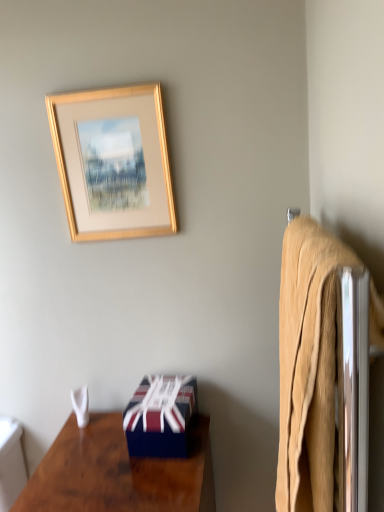
The image size is (384, 512). In order to click on blue glossy box at lower center in this screenshot , I will do `click(160, 416)`.

Is gold wooden picture frame at upper center inside the boundaries of shiny dark wood desk at lower left, or outside?

gold wooden picture frame at upper center cannot be found inside shiny dark wood desk at lower left.

Is the position of gold wooden picture frame at upper center more distant than that of shiny dark wood desk at lower left?

Yes, it is behind shiny dark wood desk at lower left.

From the picture: Is gold wooden picture frame at upper center positioned with its back to shiny dark wood desk at lower left?

That's not correct — gold wooden picture frame at upper center is not looking away from shiny dark wood desk at lower left.

Between gold wooden picture frame at upper center and shiny dark wood desk at lower left, which one has smaller size?

gold wooden picture frame at upper center is smaller.

Are white fabric towel at lower left and gold wooden picture frame at upper center far apart?

No, white fabric towel at lower left is in close proximity to gold wooden picture frame at upper center.

Is white fabric towel at lower left in front of or behind gold wooden picture frame at upper center in the image?

Clearly, white fabric towel at lower left is behind gold wooden picture frame at upper center.

Find the location of a particular element. Image resolution: width=384 pixels, height=512 pixels. picture frame located in front of the white fabric towel at lower left is located at coordinates pyautogui.click(x=113, y=162).

Is white fabric towel at lower left oriented away from gold wooden picture frame at upper center?

white fabric towel at lower left does not have its back to gold wooden picture frame at upper center.

Could you tell me if blue glossy box at lower center is turned towards gold wooden picture frame at upper center?

No, blue glossy box at lower center is not facing towards gold wooden picture frame at upper center.

Can you confirm if blue glossy box at lower center is smaller than gold wooden picture frame at upper center?

Correct, blue glossy box at lower center occupies less space than gold wooden picture frame at upper center.

Between point (157, 422) and point (63, 130), which one is positioned behind?

The point (63, 130) is more distant.

Considering the positions of objects beige cotton bath towel at right and white fabric towel at lower left in the image provided, who is more to the right, beige cotton bath towel at right or white fabric towel at lower left?

beige cotton bath towel at right.

Which is in front, point (351, 258) or point (77, 410)?

Positioned in front is point (351, 258).

Is beige cotton bath towel at right looking in the opposite direction of white fabric towel at lower left?

beige cotton bath towel at right does not have its back to white fabric towel at lower left.

From the image's perspective, is beige cotton bath towel at right below white fabric towel at lower left?

No, from the image's perspective, beige cotton bath towel at right is not below white fabric towel at lower left.

From a real-world perspective, which object rests below the other?

In real-world perspective, white fabric towel at lower left is lower.

Based on the photo, from the image's perspective, is white fabric towel at lower left located above blue glossy box at lower center?

No, from the image's perspective, white fabric towel at lower left is not over blue glossy box at lower center.

Who is bigger, white fabric towel at lower left or blue glossy box at lower center?

blue glossy box at lower center.

Between white fabric towel at lower left and blue glossy box at lower center, which one appears on the right side from the viewer's perspective?

Positioned to the right is blue glossy box at lower center.

Considering the sizes of objects shiny dark wood desk at lower left and white fabric towel at lower left in the image provided, who is smaller, shiny dark wood desk at lower left or white fabric towel at lower left?

white fabric towel at lower left.

Considering the relative sizes of shiny dark wood desk at lower left and white fabric towel at lower left in the image provided, is shiny dark wood desk at lower left shorter than white fabric towel at lower left?

Incorrect, the height of shiny dark wood desk at lower left does not fall short of that of white fabric towel at lower left.

How many degrees apart are the facing directions of shiny dark wood desk at lower left and white fabric towel at lower left?

1.52 degrees separate the facing orientations of shiny dark wood desk at lower left and white fabric towel at lower left.

Is point (109, 418) closer to viewer compared to point (87, 408)?

Yes, point (109, 418) is in front of point (87, 408).

Is there a large distance between shiny dark wood desk at lower left and blue glossy box at lower center?

No, shiny dark wood desk at lower left is not far away from blue glossy box at lower center.

In the image, is shiny dark wood desk at lower left positioned in front of or behind blue glossy box at lower center?

shiny dark wood desk at lower left is in front of blue glossy box at lower center.

Considering the relative sizes of shiny dark wood desk at lower left and blue glossy box at lower center in the image provided, is shiny dark wood desk at lower left thinner than blue glossy box at lower center?

Incorrect, the width of shiny dark wood desk at lower left is not less than that of blue glossy box at lower center.

Locate an element on the screen. This screenshot has height=512, width=384. desk below the gold wooden picture frame at upper center (from the image's perspective) is located at coordinates (119, 472).

Where is `towel/napkin located on the left of gold wooden picture frame at upper center`? The width and height of the screenshot is (384, 512). towel/napkin located on the left of gold wooden picture frame at upper center is located at coordinates (81, 405).

Looking at the image, which one is located closer to gold wooden picture frame at upper center, shiny dark wood desk at lower left or blue glossy box at lower center?

Based on the image, blue glossy box at lower center appears to be nearer to gold wooden picture frame at upper center.

Considering their positions, is shiny dark wood desk at lower left positioned further to white fabric towel at lower left than beige cotton bath towel at right?

beige cotton bath towel at right is further to white fabric towel at lower left.

Looking at the image, which one is located further to gold wooden picture frame at upper center, blue glossy box at lower center or beige cotton bath towel at right?

beige cotton bath towel at right lies further to gold wooden picture frame at upper center than the other object.

When comparing their distances from beige cotton bath towel at right, does gold wooden picture frame at upper center or white fabric towel at lower left seem closer?

gold wooden picture frame at upper center is closer to beige cotton bath towel at right.

Which object lies nearer to the anchor point white fabric towel at lower left, gold wooden picture frame at upper center or shiny dark wood desk at lower left?

shiny dark wood desk at lower left.

Based on their spatial positions, is shiny dark wood desk at lower left or white fabric towel at lower left further from gold wooden picture frame at upper center?

white fabric towel at lower left is positioned further to the anchor gold wooden picture frame at upper center.

Looking at the image, which one is located closer to beige cotton bath towel at right, gold wooden picture frame at upper center or shiny dark wood desk at lower left?

shiny dark wood desk at lower left is closer to beige cotton bath towel at right.

Considering their positions, is gold wooden picture frame at upper center positioned closer to blue glossy box at lower center than shiny dark wood desk at lower left?

The object closer to blue glossy box at lower center is shiny dark wood desk at lower left.

The image size is (384, 512). In order to click on desk located between beige cotton bath towel at right and blue glossy box at lower center in the depth direction in this screenshot , I will do point(119,472).

This screenshot has height=512, width=384. I want to click on box between gold wooden picture frame at upper center and shiny dark wood desk at lower left in the up-down direction, so click(x=160, y=416).

Locate an element on the screen. The image size is (384, 512). bath towel that lies between gold wooden picture frame at upper center and shiny dark wood desk at lower left from top to bottom is located at coordinates (308, 366).

Where is `box between gold wooden picture frame at upper center and white fabric towel at lower left vertically`? Image resolution: width=384 pixels, height=512 pixels. box between gold wooden picture frame at upper center and white fabric towel at lower left vertically is located at coordinates (160, 416).